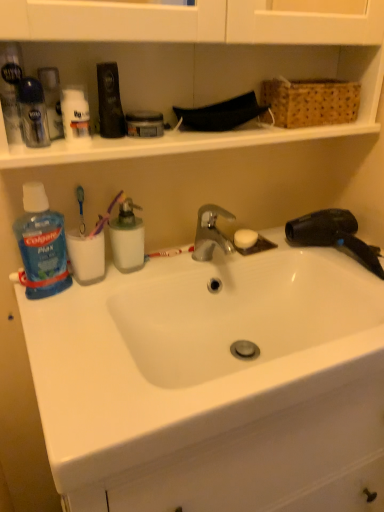
Question: Considering the relative sizes of white ceramic sink at center and translucent plastic container at center, acting as the 1th cleaning product starting from the right, in the image provided, is white ceramic sink at center shorter than translucent plastic container at center, acting as the 1th cleaning product starting from the right,?

Choices:
 (A) no
 (B) yes

Answer: (B)

Question: From the image's perspective, is white ceramic sink at center beneath translucent plastic container at center, positioned as the second cleaning product in left-to-right order?

Choices:
 (A) yes
 (B) no

Answer: (A)

Question: Is white ceramic sink at center outside translucent plastic container at center, positioned as the second cleaning product in left-to-right order?

Choices:
 (A) no
 (B) yes

Answer: (B)

Question: Is white ceramic sink at center thinner than translucent plastic container at center, positioned as the second cleaning product in left-to-right order?

Choices:
 (A) no
 (B) yes

Answer: (A)

Question: Is white ceramic sink at center surrounding translucent plastic container at center, positioned as the second cleaning product in left-to-right order?

Choices:
 (A) no
 (B) yes

Answer: (A)

Question: Is translucent plastic container at center, positioned as the second cleaning product in left-to-right order, in front of or behind blue plastic mouthwash at left, which is the 1th cleaning product in left-to-right order, in the image?

Choices:
 (A) front
 (B) behind

Answer: (B)

Question: From their relative heights in the image, would you say translucent plastic container at center, acting as the 1th cleaning product starting from the right, is taller or shorter than blue plastic mouthwash at left, the second cleaning product viewed from the right?

Choices:
 (A) short
 (B) tall

Answer: (A)

Question: In terms of width, does translucent plastic container at center, positioned as the second cleaning product in left-to-right order, look wider or thinner when compared to blue plastic mouthwash at left, which is the 1th cleaning product in left-to-right order?

Choices:
 (A) thin
 (B) wide

Answer: (A)

Question: Based on their sizes in the image, would you say translucent plastic container at center, acting as the 1th cleaning product starting from the right, is bigger or smaller than blue plastic mouthwash at left, the second cleaning product viewed from the right?

Choices:
 (A) big
 (B) small

Answer: (B)

Question: Is woven brown basket at upper right bigger or smaller than white matte deodorant at upper left, arranged as the third toiletry when viewed from the left?

Choices:
 (A) big
 (B) small

Answer: (A)

Question: Does point (349, 90) appear closer or farther from the camera than point (79, 134)?

Choices:
 (A) closer
 (B) farther

Answer: (B)

Question: From the image's perspective, is woven brown basket at upper right located above or below white matte deodorant at upper left, the 1th toiletry viewed from the right?

Choices:
 (A) below
 (B) above

Answer: (B)

Question: In terms of width, does woven brown basket at upper right look wider or thinner when compared to white matte deodorant at upper left, the 1th toiletry viewed from the right?

Choices:
 (A) thin
 (B) wide

Answer: (B)

Question: In terms of width, does white matte deodorant at upper left, arranged as the third toiletry when viewed from the left, look wider or thinner when compared to blue plastic mouthwash at left, which is the 1th cleaning product in left-to-right order?

Choices:
 (A) wide
 (B) thin

Answer: (B)

Question: In terms of height, does white matte deodorant at upper left, arranged as the third toiletry when viewed from the left, look taller or shorter compared to blue plastic mouthwash at left, which is the 1th cleaning product in left-to-right order?

Choices:
 (A) short
 (B) tall

Answer: (A)